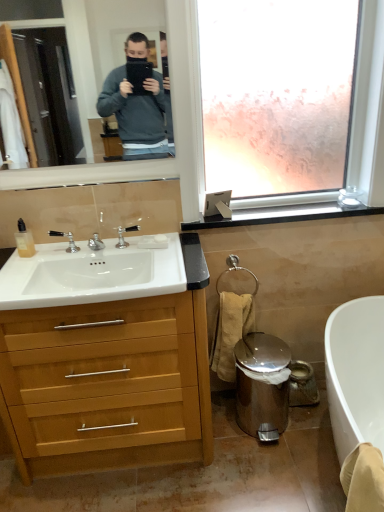
In order to face beige cotton towel at lower right, should I rotate leftwards or rightwards?

Turn right approximately 5.437 degrees to face it.

This screenshot has height=512, width=384. What do you see at coordinates (230, 331) in the screenshot? I see `beige cotton towel at lower right` at bounding box center [230, 331].

At what (x,y) coordinates should I click in order to perform the action: click on white matte soap at sink. Please return your answer as a coordinate pair (x, y). This screenshot has height=512, width=384. Looking at the image, I should click on (160, 238).

In order to face white glossy sink at left, should I rotate leftwards or rightwards?

Turn left approximately 12.877 degrees to face it.

In order to click on white glossy sink at left in this screenshot , I will do `click(91, 274)`.

In the scene shown: What is the approximate height of matte black tablet at upper center?

matte black tablet at upper center is 23.29 inches tall.

What is the approximate width of matte black tablet at upper center?

The width of matte black tablet at upper center is 1.14 inches.

What is the approximate width of polished chrome faucet at sink left, the 1th faucet from the left?

The width of polished chrome faucet at sink left, the 1th faucet from the left, is 1.77 inches.

Describe the element at coordinates (24, 240) in the screenshot. I see `translucent plastic bottle at sink left` at that location.

The width and height of the screenshot is (384, 512). Find the location of `clear glass window at upper center`. clear glass window at upper center is located at coordinates tap(276, 98).

From the image's perspective, which one is positioned lower, polished chrome faucet at sink left, the second faucet when ordered from right to left, or white glossy bathtub at lower right?

white glossy bathtub at lower right appears lower in the image.

From a real-world perspective, is polished chrome faucet at sink left, the second faucet when ordered from right to left, physically above white glossy bathtub at lower right?

Yes, from a real-world perspective, polished chrome faucet at sink left, the second faucet when ordered from right to left, is over white glossy bathtub at lower right

Based on their positions, is polished chrome faucet at sink left, the 1th faucet from the left, located to the left or right of white glossy bathtub at lower right?

Based on their positions, polished chrome faucet at sink left, the 1th faucet from the left, is located to the left of white glossy bathtub at lower right.

Looking at this image, is white glossy bathtub at lower right at the back of polished chrome faucet at sink left, the 1th faucet from the left?

polished chrome faucet at sink left, the 1th faucet from the left, is not turned away from white glossy bathtub at lower right.

Considering the relative sizes of white matte soap at sink and clear glass window at upper center in the image provided, is white matte soap at sink bigger than clear glass window at upper center?

Incorrect, white matte soap at sink is not larger than clear glass window at upper center.

From a real-world perspective, is white matte soap at sink on top of clear glass window at upper center?

No, from a real-world perspective, white matte soap at sink is not above clear glass window at upper center.

Does white matte soap at sink appear on the left side of clear glass window at upper center?

Yes.

Consider the image. From the image's perspective, would you say white matte soap at sink is positioned over clear glass window at upper center?

Incorrect, from the image's perspective, white matte soap at sink is lower than clear glass window at upper center.

Consider the image. Is beige cotton towel at lower right turned away from matte black tablet at upper center?

No, beige cotton towel at lower right's orientation is not away from matte black tablet at upper center.

Image resolution: width=384 pixels, height=512 pixels. Find the location of `mirror above the beige cotton towel at lower right (from the image's perspective)`. mirror above the beige cotton towel at lower right (from the image's perspective) is located at coordinates (99, 42).

Looking at this image, are beige cotton towel at lower right and matte black tablet at upper center located far from each other?

beige cotton towel at lower right is far away from matte black tablet at upper center.

Considering the sizes of beige cotton towel at lower right and matte black tablet at upper center in the image, is beige cotton towel at lower right bigger or smaller than matte black tablet at upper center?

Clearly, beige cotton towel at lower right is larger in size than matte black tablet at upper center.

Between light wood/wooden cabinet at left and black plastic window sill at upper right, which one has more height?

Standing taller between the two is light wood/wooden cabinet at left.

Is light wood/wooden cabinet at left wider than black plastic window sill at upper right?

Yes.

Which object is positioned more to the left, light wood/wooden cabinet at left or black plastic window sill at upper right?

From the viewer's perspective, light wood/wooden cabinet at left appears more on the left side.

From the image's perspective, is white glossy bathtub at lower right beneath translucent plastic bottle at sink left?

Yes, from the image's perspective, white glossy bathtub at lower right is beneath translucent plastic bottle at sink left.

How much distance is there between white glossy bathtub at lower right and translucent plastic bottle at sink left?

white glossy bathtub at lower right is 4.78 feet away from translucent plastic bottle at sink left.

Visually, is white glossy bathtub at lower right positioned to the left or to the right of translucent plastic bottle at sink left?

white glossy bathtub at lower right is positioned on translucent plastic bottle at sink left's right side.

Considering the relative sizes of white glossy bathtub at lower right and translucent plastic bottle at sink left in the image provided, is white glossy bathtub at lower right taller than translucent plastic bottle at sink left?

Yes, white glossy bathtub at lower right is taller than translucent plastic bottle at sink left.

From the image's perspective, is clear glass window at upper center located beneath polished stainless steel trash can at lower right?

No, from the image's perspective, clear glass window at upper center is not beneath polished stainless steel trash can at lower right.

Locate an element on the screen. trash bin/can below the clear glass window at upper center (from a real-world perspective) is located at coordinates (261, 384).

Is clear glass window at upper center outside of polished stainless steel trash can at lower right?

Indeed, clear glass window at upper center is completely outside polished stainless steel trash can at lower right.

Which object is closer to the camera, clear glass window at upper center or polished stainless steel trash can at lower right?

clear glass window at upper center is more forward.

From a real-world perspective, which is physically below, polished stainless steel trash can at lower right or matte black tablet at upper center?

polished stainless steel trash can at lower right, from a real-world perspective.

Is polished stainless steel trash can at lower right further to the viewer compared to matte black tablet at upper center?

Yes, it is behind matte black tablet at upper center.

Based on the photo, what's the angular difference between polished stainless steel trash can at lower right and matte black tablet at upper center's facing directions?

The facing directions of polished stainless steel trash can at lower right and matte black tablet at upper center are 1.96 degrees apart.

The height and width of the screenshot is (512, 384). What are the coordinates of `the 2nd faucet counting from the left of the white glossy bathtub at lower right` in the screenshot? It's located at (68, 240).

Where is `soap below the clear glass window at upper center (from the image's perspective)`? This screenshot has height=512, width=384. soap below the clear glass window at upper center (from the image's perspective) is located at coordinates (160, 238).

When comparing their distances from clear glass window at upper center, does light wood/wooden cabinet at left or polished stainless steel trash can at lower right seem further?

polished stainless steel trash can at lower right is further to clear glass window at upper center.

Estimate the real-world distances between objects in this image. Which object is closer to black plastic window sill at upper right, translucent plastic bottle at sink left or polished chrome faucet at sink left, which is the second faucet in left-to-right order?

Based on the image, polished chrome faucet at sink left, which is the second faucet in left-to-right order, appears to be nearer to black plastic window sill at upper right.

Which object lies further to the anchor point light wood/wooden cabinet at left, polished chrome faucet at sink left, the 1th faucet from the left, or clear glass window at upper center?

Based on the image, clear glass window at upper center appears to be further to light wood/wooden cabinet at left.

Based on their spatial positions, is white glossy sink at left or beige cotton towel at lower right further from translucent plastic bottle at sink left?

beige cotton towel at lower right is further to translucent plastic bottle at sink left.

Estimate the real-world distances between objects in this image. Which object is closer to white glossy sink at left, black plastic window sill at upper right or polished stainless steel trash can at lower right?

Based on the image, black plastic window sill at upper right appears to be nearer to white glossy sink at left.

Estimate the real-world distances between objects in this image. Which object is further from black plastic window sill at upper right, white glossy sink at left or white glossy bathtub at lower right?

Among the two, white glossy bathtub at lower right is located further to black plastic window sill at upper right.

Considering their positions, is polished stainless steel trash can at lower right positioned closer to white matte soap at sink than beige cotton towel at lower right?

Among the two, beige cotton towel at lower right is located nearer to white matte soap at sink.

Looking at the image, which one is located closer to polished stainless steel trash can at lower right, polished chrome faucet at sink left, the 1th faucet from the left, or white matte soap at sink?

white matte soap at sink.

Identify the location of faucet located between white glossy sink at left and polished chrome faucet at sink left, which is counted as the first faucet, starting from the right, in the depth direction. The height and width of the screenshot is (512, 384). (68, 240).

Where is `trash bin/can situated between translucent plastic bottle at sink left and white glossy bathtub at lower right from left to right`? trash bin/can situated between translucent plastic bottle at sink left and white glossy bathtub at lower right from left to right is located at coordinates (261, 384).

You are a GUI agent. You are given a task and a screenshot of the screen. Output one action in this format:
    pyautogui.click(x=<x>, y=<y>)
    Task: Click on the window frame between matte black tablet at upper center and polished stainless steel trash can at lower right from top to bottom
    
    Given the screenshot: What is the action you would take?
    pyautogui.click(x=276, y=98)

You are a GUI agent. You are given a task and a screenshot of the screen. Output one action in this format:
    pyautogui.click(x=<x>, y=<y>)
    Task: Click on the window frame between translucent plastic bottle at sink left and black plastic window sill at upper right from left to right
    
    Given the screenshot: What is the action you would take?
    pyautogui.click(x=276, y=98)